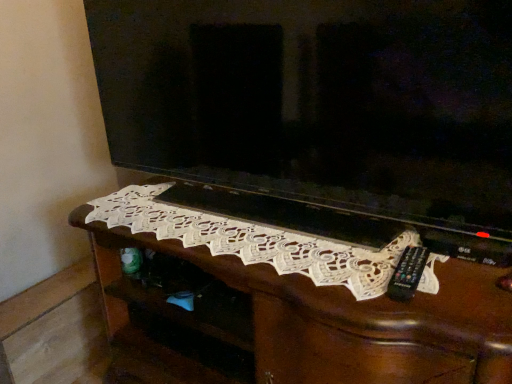
Question: Considering the relative positions of matte black television at center and white lace doily at center in the image provided, is matte black television at center to the left or to the right of white lace doily at center?

Choices:
 (A) right
 (B) left

Answer: (B)

Question: Considering the positions of matte black television at center and white lace doily at center in the image, is matte black television at center wider or thinner than white lace doily at center?

Choices:
 (A) wide
 (B) thin

Answer: (B)

Question: Which object is positioned farthest from the white lace doily at center?

Choices:
 (A) white lace doily at center
 (B) matte black television at center

Answer: (B)

Question: Which object is the farthest from the white lace doily at center?

Choices:
 (A) matte black television at center
 (B) white lace doily at center

Answer: (A)